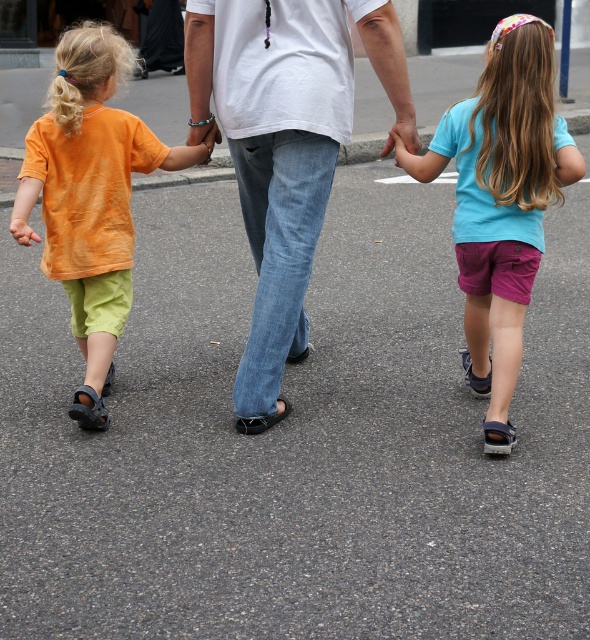
Question: Is matte blue t-shirt at center to the right of matte skin hand at center from the viewer's perspective?

Choices:
 (A) yes
 (B) no

Answer: (A)

Question: Which of the following is the farthest from the observer?

Choices:
 (A) matte blue t-shirt at center
 (B) denim jeans at center

Answer: (B)

Question: Which of the following is the closest to the observer?

Choices:
 (A) (225, 64)
 (B) (496, 376)
 (C) (395, 131)

Answer: (B)

Question: Is matte blue t-shirt at center positioned in front of orange cotton shirt at left?

Choices:
 (A) no
 (B) yes

Answer: (B)

Question: Which of these objects is positioned farthest from the denim jeans at center?

Choices:
 (A) matte skin hand at center
 (B) orange cotton shirt at left
 (C) matte blue t-shirt at center

Answer: (C)

Question: Is denim jeans at center positioned in front of matte skin hand at center?

Choices:
 (A) yes
 (B) no

Answer: (A)